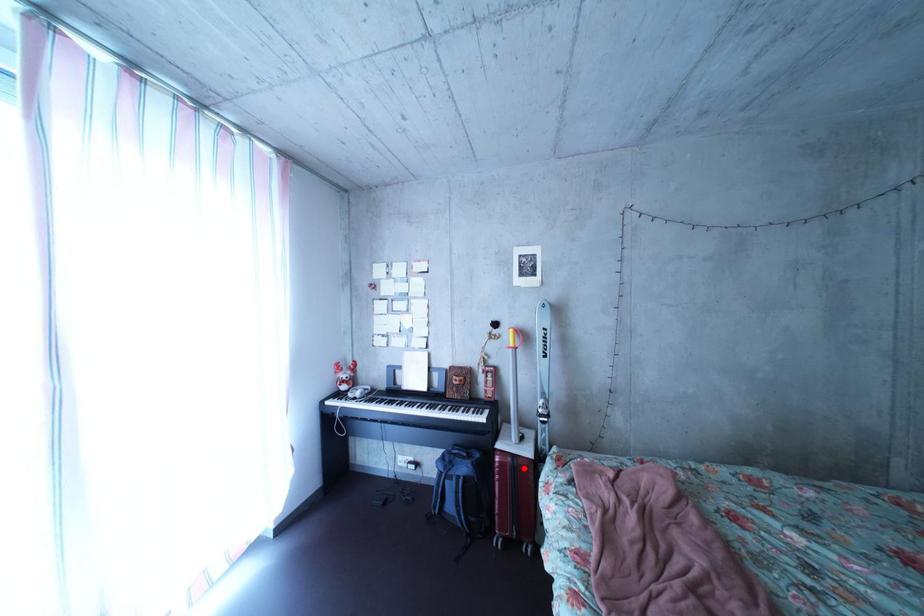
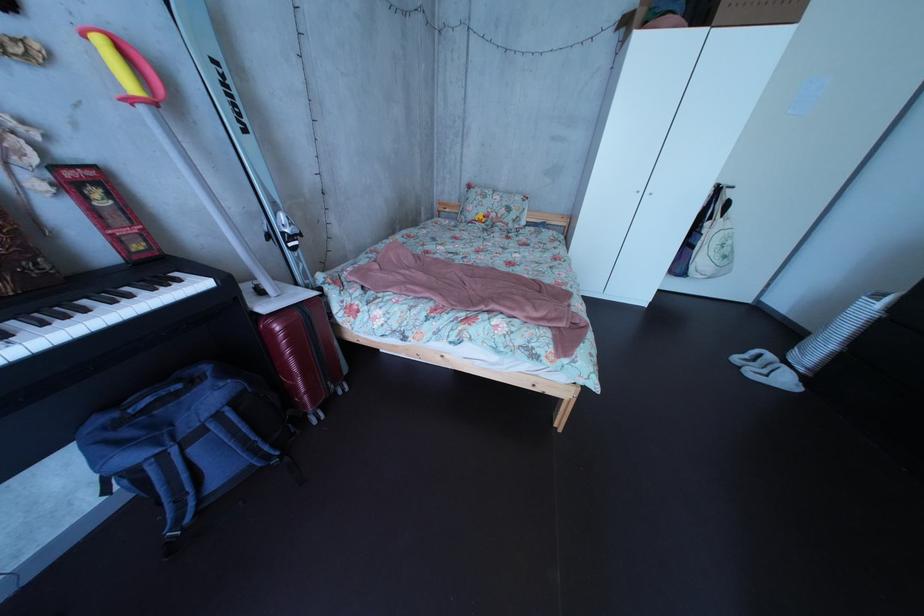
Question: A red point is marked in image1. In image2, is the corresponding 3D point closer to the camera or farther? Reply with the corresponding letter.

Choices:
 (A) The corresponding 3D point is closer.
 (B) The corresponding 3D point is farther.

Answer: (A)